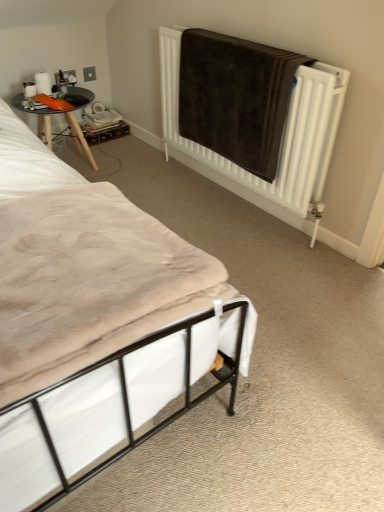
Question: Considering the positions of brown towel at upper right and wooden table at left in the image, is brown towel at upper right taller or shorter than wooden table at left?

Choices:
 (A) short
 (B) tall

Answer: (B)

Question: Is brown towel at upper right in front of or behind wooden table at left in the image?

Choices:
 (A) front
 (B) behind

Answer: (A)

Question: Estimate the real-world distances between objects in this image. Which object is closer to the wooden table at left?

Choices:
 (A) brown towel at upper right
 (B) beige fabric mattress at lower left
 (C) white fabric bed at lower left

Answer: (A)

Question: Which of these objects is positioned farthest from the white fabric bed at lower left?

Choices:
 (A) beige fabric mattress at lower left
 (B) brown towel at upper right
 (C) wooden table at left

Answer: (C)